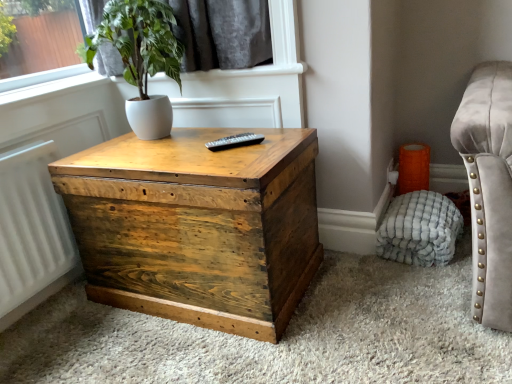
Identify the location of vacant region to the left of black plastic remote at center. This screenshot has width=512, height=384. (189, 152).